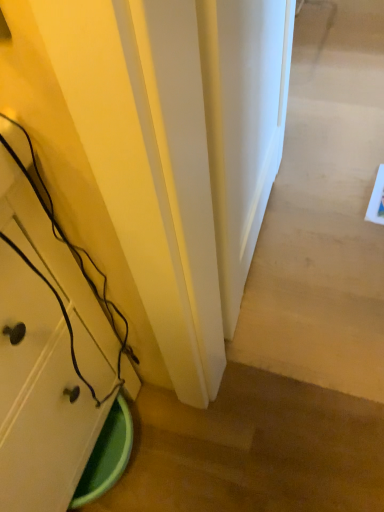
Question: Is white smooth door at center oriented away from matte white cabinet at lower left?

Choices:
 (A) no
 (B) yes

Answer: (A)

Question: Would you say white smooth door at center is a long distance from matte white cabinet at lower left?

Choices:
 (A) yes
 (B) no

Answer: (B)

Question: From a real-world perspective, is white smooth door at center physically below matte white cabinet at lower left?

Choices:
 (A) no
 (B) yes

Answer: (A)

Question: Could matte white cabinet at lower left be considered to be inside white smooth door at center?

Choices:
 (A) no
 (B) yes

Answer: (A)

Question: Considering the relative sizes of white smooth door at center and matte white cabinet at lower left in the image provided, is white smooth door at center smaller than matte white cabinet at lower left?

Choices:
 (A) yes
 (B) no

Answer: (A)

Question: Are white smooth door at center and matte white cabinet at lower left beside each other?

Choices:
 (A) yes
 (B) no

Answer: (B)

Question: From the image's perspective, is matte white cabinet at lower left on top of white smooth door at center?

Choices:
 (A) no
 (B) yes

Answer: (A)

Question: Is matte white cabinet at lower left smaller than white smooth door at center?

Choices:
 (A) yes
 (B) no

Answer: (B)

Question: Can you confirm if matte white cabinet at lower left is bigger than white smooth door at center?

Choices:
 (A) yes
 (B) no

Answer: (A)

Question: Is the depth of matte white cabinet at lower left less than that of white smooth door at center?

Choices:
 (A) no
 (B) yes

Answer: (B)

Question: Does matte white cabinet at lower left have a greater width compared to white smooth door at center?

Choices:
 (A) yes
 (B) no

Answer: (A)

Question: Is white smooth door at center completely or partially inside matte white cabinet at lower left?

Choices:
 (A) no
 (B) yes

Answer: (A)

Question: From a real-world perspective, is white smooth door at center physically located above or below matte white cabinet at lower left?

Choices:
 (A) above
 (B) below

Answer: (A)